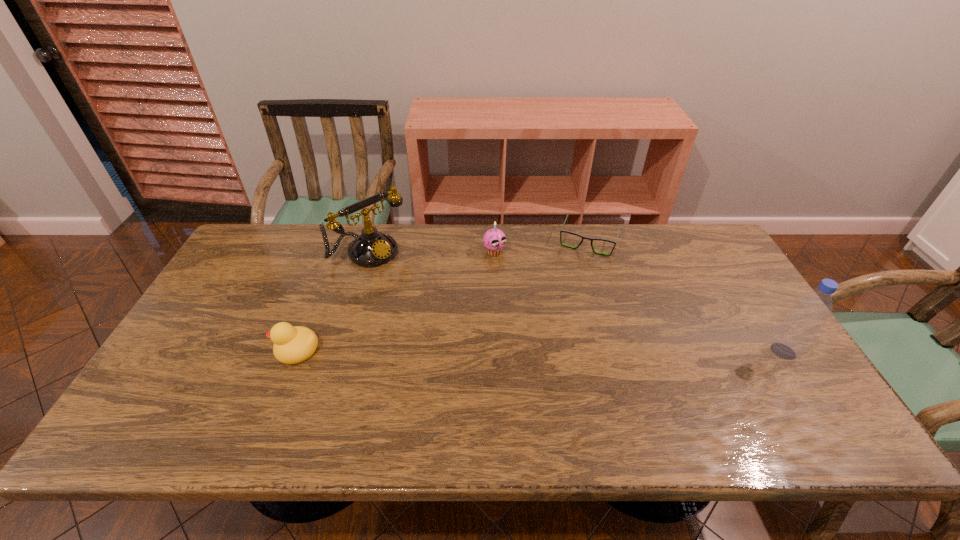
Find the location of a particular element. free space that is in between the cupcake and the telephone is located at coordinates (432, 252).

At what (x,y) coordinates should I click in order to perform the action: click on free point between the shortest object and the fourth tallest object. Please return your answer as a coordinate pair (x, y). This screenshot has height=540, width=960. Looking at the image, I should click on (443, 295).

Identify the location of vacant space that is in between the bottle and the fourth object from left to right. (685, 296).

This screenshot has width=960, height=540. I want to click on free space between the third tallest object and the rightmost object, so click(x=638, y=301).

This screenshot has height=540, width=960. In order to click on free space between the duckling and the second tallest object in this screenshot , I will do `click(333, 301)`.

The width and height of the screenshot is (960, 540). What are the coordinates of `free space between the bottle and the cupcake` in the screenshot? It's located at (638, 301).

Where is `free space between the bottle and the fourth tallest object`? free space between the bottle and the fourth tallest object is located at coordinates pos(540,350).

Find the location of `free spot between the rightmost object and the shortest object`. free spot between the rightmost object and the shortest object is located at coordinates (685, 296).

Locate an element on the screen. This screenshot has height=540, width=960. free space between the bottle and the telephone is located at coordinates (576, 302).

Locate an element on the screen. Image resolution: width=960 pixels, height=540 pixels. vacant space that is in between the rightmost object and the third shortest object is located at coordinates (638, 301).